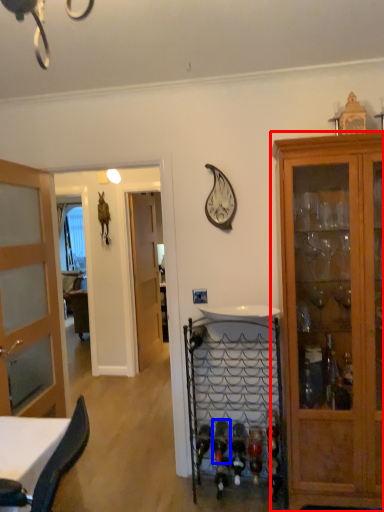
Question: Which object appears closest to the camera in this image, cabinetry (highlighted by a red box) or wine bottle (highlighted by a blue box)?

Choices:
 (A) cabinetry
 (B) wine bottle

Answer: (A)